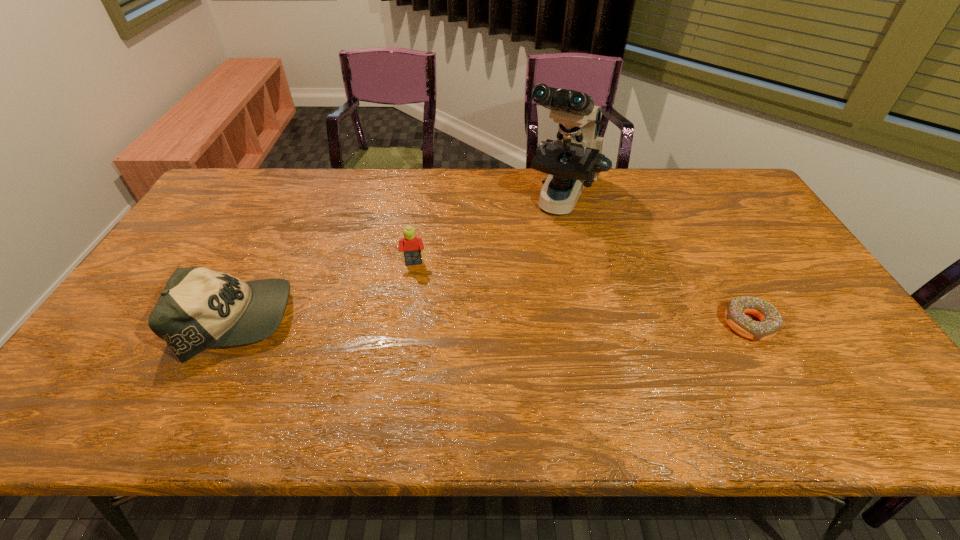
This screenshot has height=540, width=960. Find the location of `free space between the tallest object and the Lego`. free space between the tallest object and the Lego is located at coordinates (489, 232).

I want to click on free point between the Lego and the leftmost object, so click(x=325, y=292).

Identify the location of empty space between the microscope and the Lego. This screenshot has height=540, width=960. (489, 232).

At what (x,y) coordinates should I click in order to perform the action: click on object that is the closest one to the third object from left to right. Please return your answer as a coordinate pair (x, y). The width and height of the screenshot is (960, 540). Looking at the image, I should click on (412, 246).

Point out which object is positioned as the nearest to the doughnut. Please provide its 2D coordinates. Your answer should be formatted as a tuple, i.e. [(x, y)], where the tuple contains the x and y coordinates of a point satisfying the conditions above.

[(573, 161)]

Find the location of a particular element. Image resolution: width=960 pixels, height=540 pixels. free location that satisfies the following two spatial constraints: 1. on the back side of the microscope; 2. on the right side of the second farthest object is located at coordinates (424, 200).